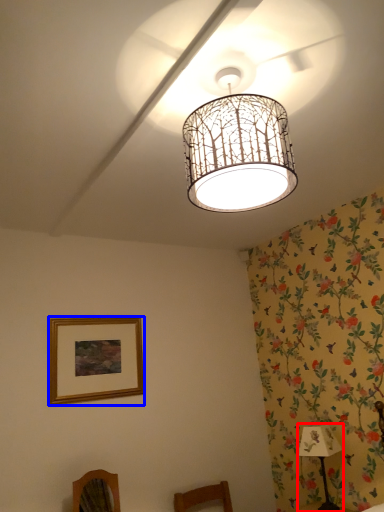
Question: Which object is closer to the camera taking this photo, table lamp (highlighted by a red box) or picture frame (highlighted by a blue box)?

Choices:
 (A) table lamp
 (B) picture frame

Answer: (A)